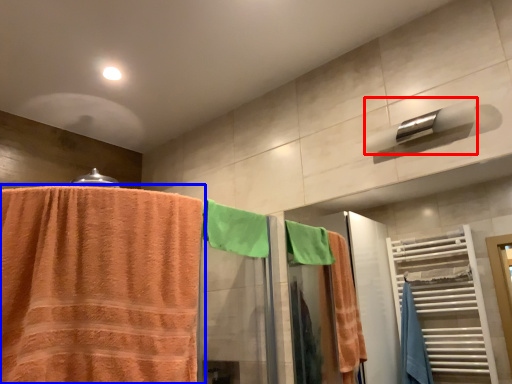
Question: Which point is further to the camera, towel bar (highlighted by a red box) or towel (highlighted by a blue box)?

Choices:
 (A) towel bar
 (B) towel

Answer: (A)